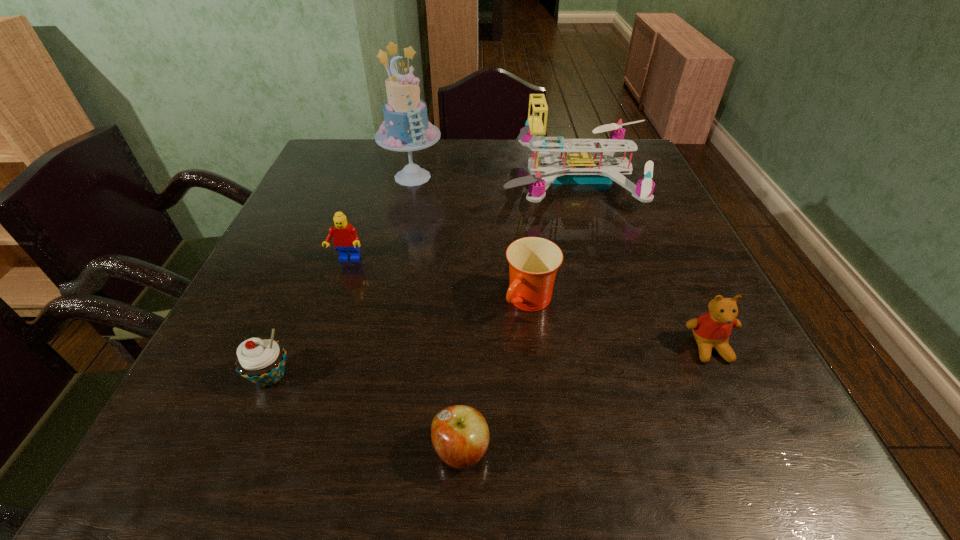
Identify the location of free space at the near left corner of the desktop. (205, 470).

Locate an element on the screen. vacant space at the far right corner is located at coordinates (620, 152).

The width and height of the screenshot is (960, 540). I want to click on vacant space that's between the apple and the cupcake, so click(366, 413).

You are a GUI agent. You are given a task and a screenshot of the screen. Output one action in this format:
    pyautogui.click(x=<x>, y=<y>)
    Task: Click on the vacant area that lies between the cupcake and the third farthest object
    The image size is (960, 540).
    Given the screenshot: What is the action you would take?
    pyautogui.click(x=309, y=318)

Identify the location of empty location between the cup and the drone. (554, 240).

The height and width of the screenshot is (540, 960). Find the location of `vacant space that's between the fourth nearest object and the cupcake`. vacant space that's between the fourth nearest object and the cupcake is located at coordinates (400, 339).

This screenshot has height=540, width=960. Find the location of `vacant point located between the teddy bear and the drone`. vacant point located between the teddy bear and the drone is located at coordinates (643, 264).

Where is `free space between the cup and the sixth shortest object`? Image resolution: width=960 pixels, height=540 pixels. free space between the cup and the sixth shortest object is located at coordinates (554, 240).

You are a GUI agent. You are given a task and a screenshot of the screen. Output one action in this format:
    pyautogui.click(x=<x>, y=<y>)
    Task: Click on the empty space that is in between the tallest object and the fifth nearest object
    Image resolution: width=960 pixels, height=540 pixels.
    Given the screenshot: What is the action you would take?
    pyautogui.click(x=380, y=219)

Where is `unoccupied position between the second tallest object and the Lego`? The height and width of the screenshot is (540, 960). unoccupied position between the second tallest object and the Lego is located at coordinates (462, 220).